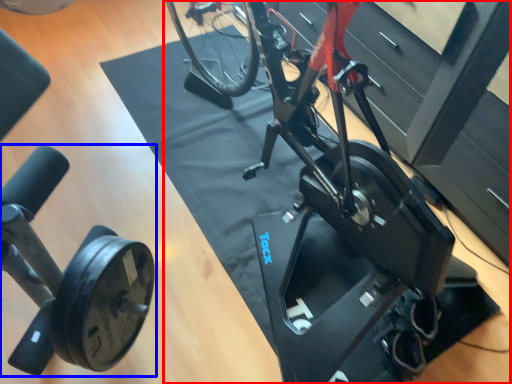
Question: Among these objects, which one is nearest to the camera, stationary bicycle (highlighted by a red box) or stationary bicycle (highlighted by a blue box)?

Choices:
 (A) stationary bicycle
 (B) stationary bicycle

Answer: (B)